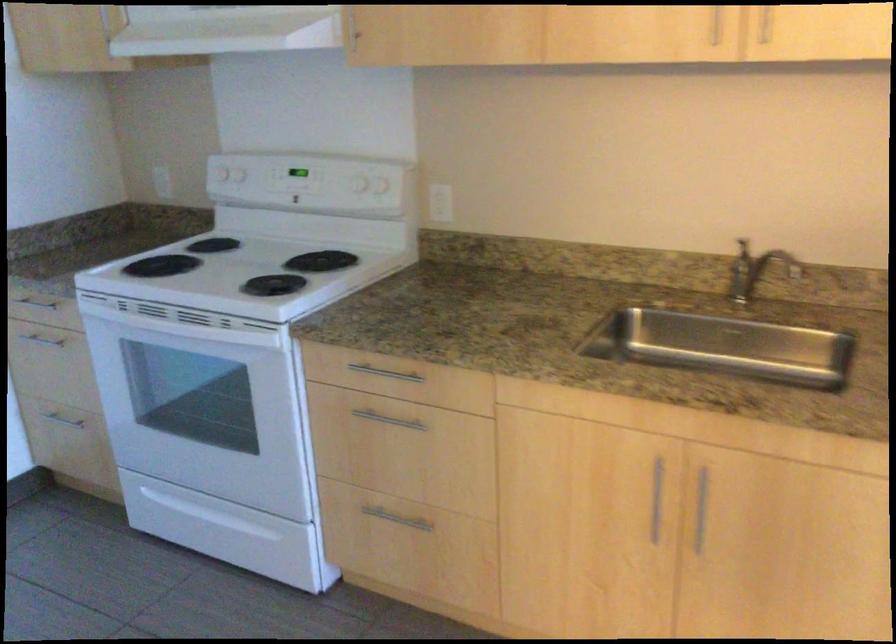
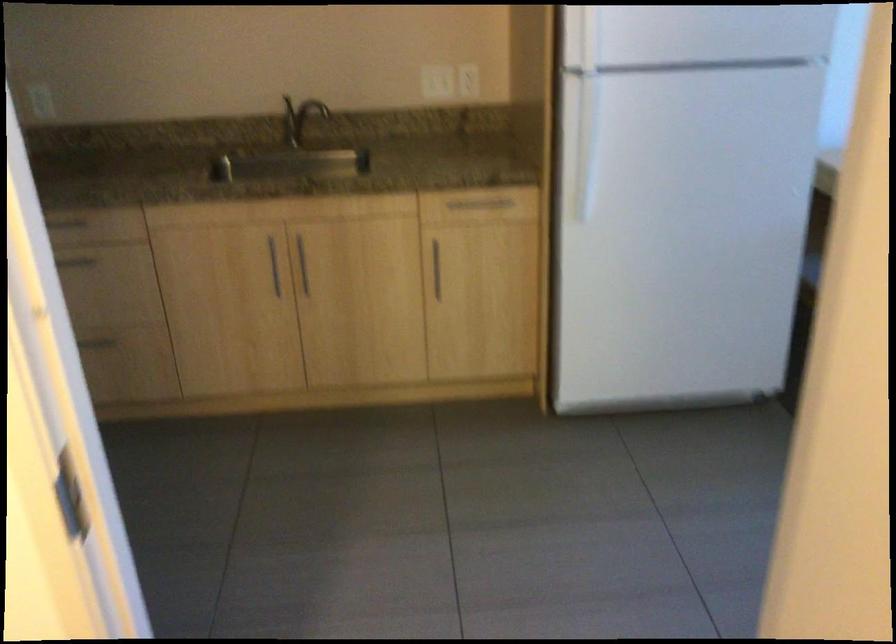
The point at (702, 500) is marked in the first image. Where is the corresponding point in the second image?

(303, 265)